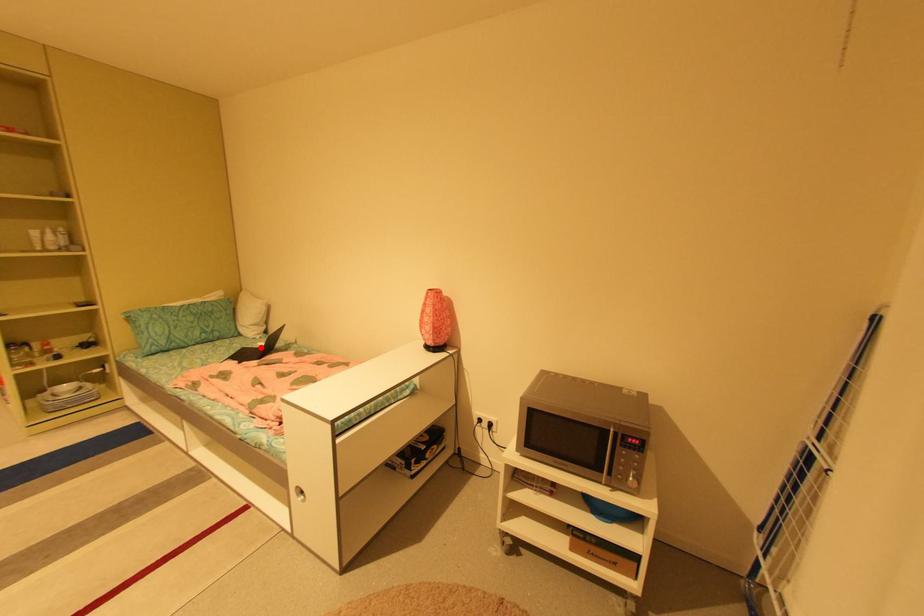
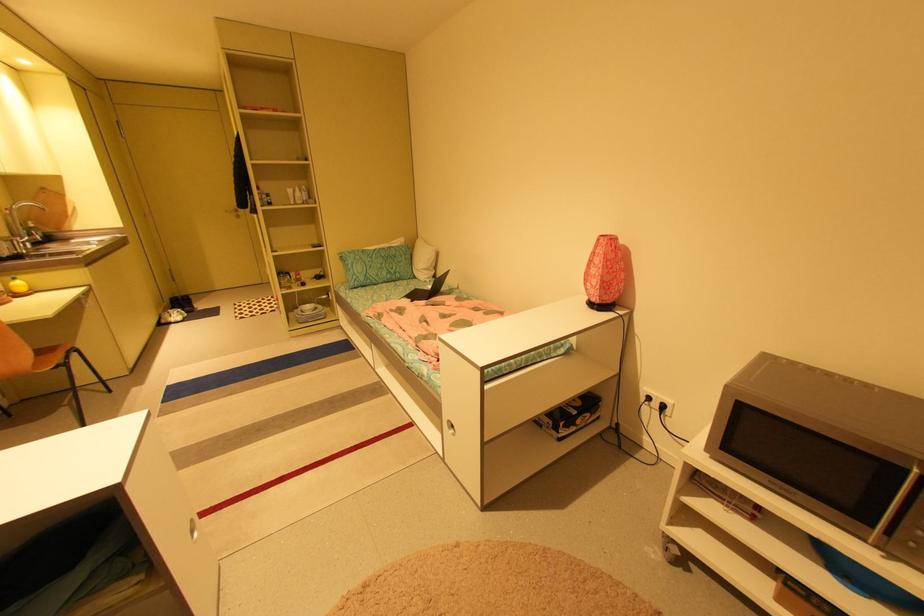
The point at the highlighted location is marked in the first image. Where is the corresponding point in the second image?

(431, 290)